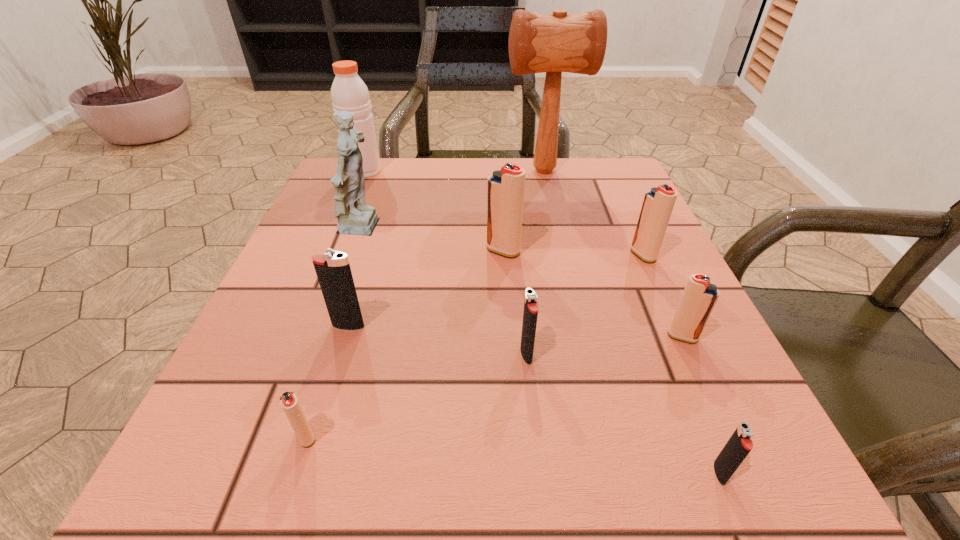
I want to click on the second smallest red igniter, so click(699, 297).

Where is `the second nearest object`? The width and height of the screenshot is (960, 540). the second nearest object is located at coordinates (288, 400).

Identify the location of the smallest red igniter. (288, 400).

The width and height of the screenshot is (960, 540). I want to click on the nearest black igniter, so click(x=739, y=445).

The image size is (960, 540). I want to click on the nearest igniter, so click(739, 445).

Where is `free space located on the strike surface of the tallest object`? Image resolution: width=960 pixels, height=540 pixels. free space located on the strike surface of the tallest object is located at coordinates (439, 171).

This screenshot has height=540, width=960. What are the coordinates of `free region located on the strike surface of the tallest object` in the screenshot? It's located at (447, 171).

Image resolution: width=960 pixels, height=540 pixels. What are the coordinates of `vacant area located 0.240m on the strike surface of the tallest object` in the screenshot? It's located at (406, 171).

Locate an element on the screen. The image size is (960, 540). vacant space positioned 0.130m on the front of the shaker is located at coordinates (348, 209).

Find the location of `blank space located 0.250m on the front-facing side of the figurine`. blank space located 0.250m on the front-facing side of the figurine is located at coordinates pyautogui.click(x=511, y=230).